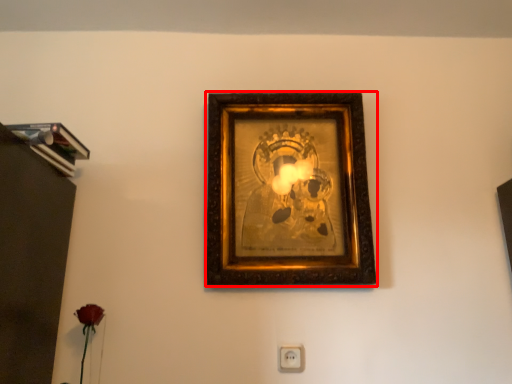
Question: Observing the image, what is the correct spatial positioning of picture frame (annotated by the red box) in reference to electric outlet?

Choices:
 (A) right
 (B) left

Answer: (A)